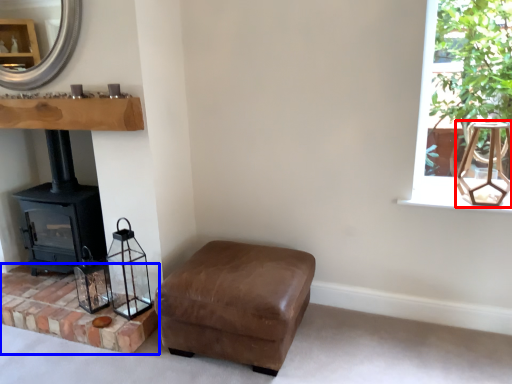
Question: Among these objects, which one is farthest to the camera, lamp (highlighted by a red box) or brickwork (highlighted by a blue box)?

Choices:
 (A) lamp
 (B) brickwork

Answer: (B)